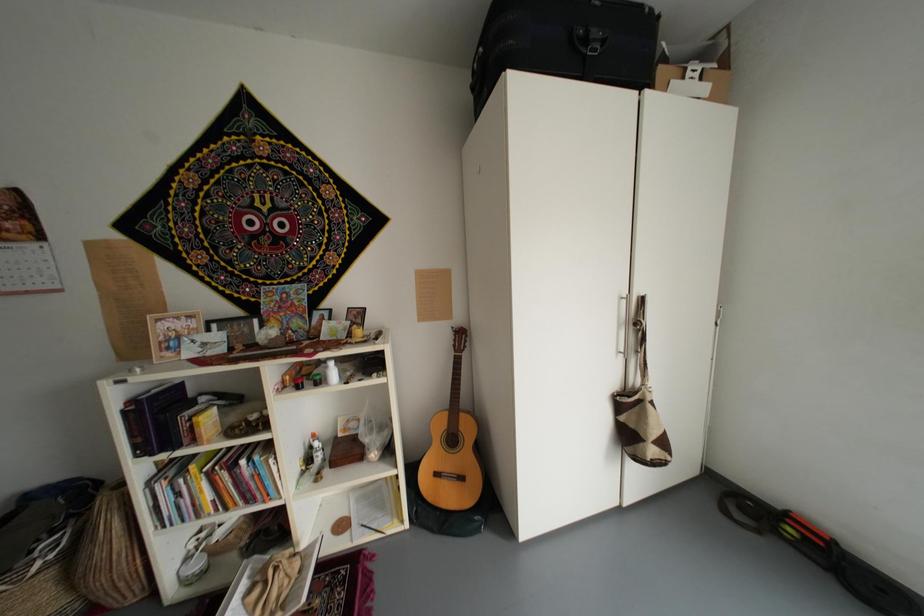
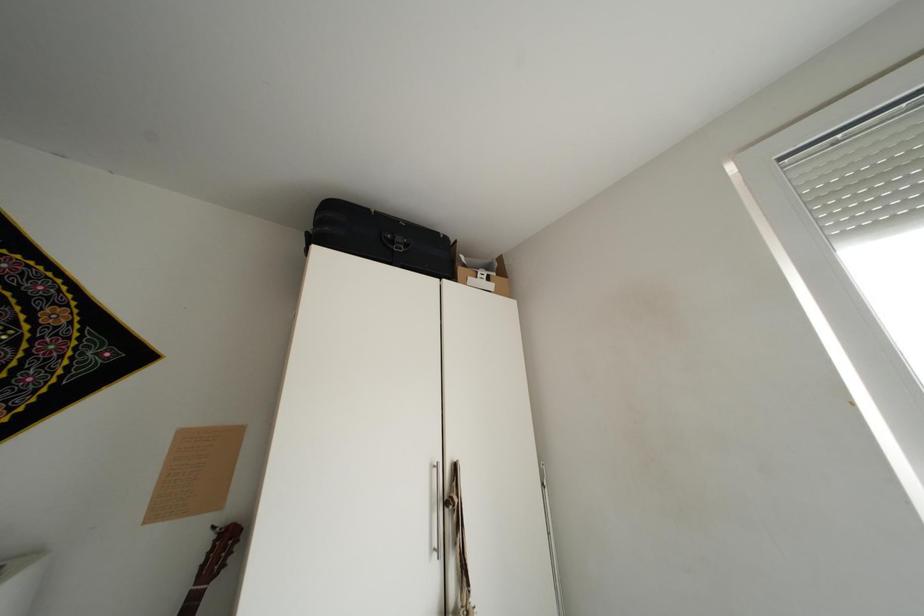
First-person continuous shooting, in which direction is the camera rotating?

The camera's rotation is toward right-up.